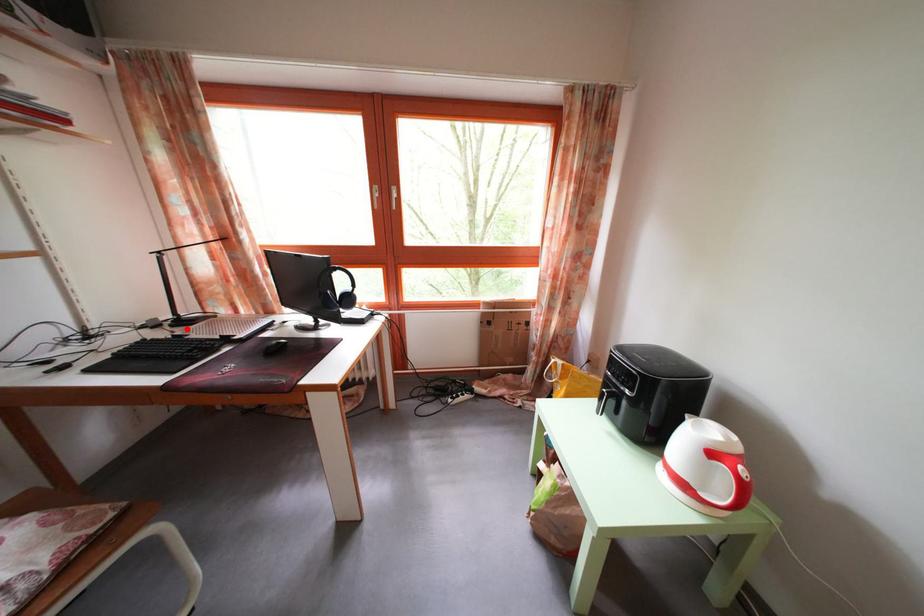
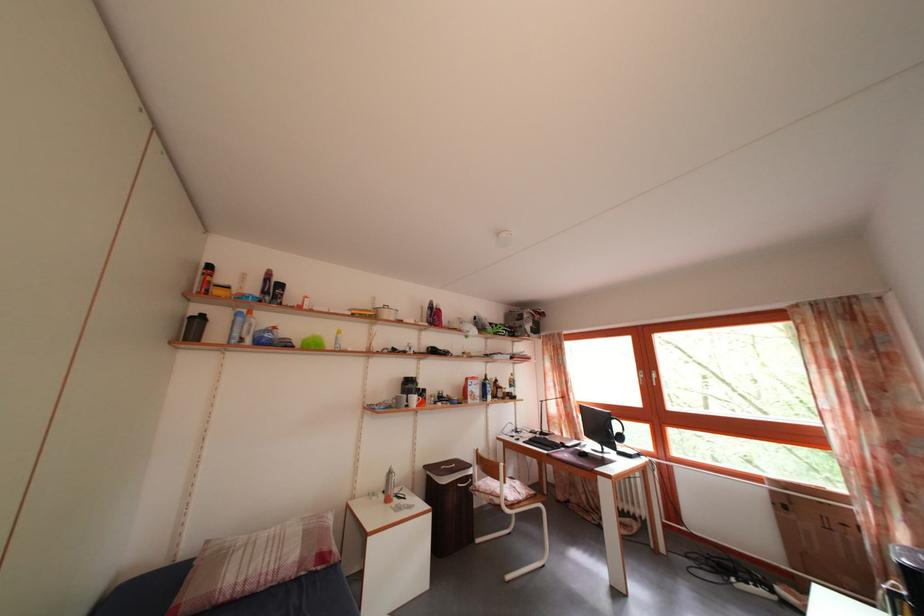
Question: A red point is marked in image1. In image2, is the corresponding 3D point closer to the camera or farther? Reply with the corresponding letter.

Choices:
 (A) The corresponding 3D point is closer.
 (B) The corresponding 3D point is farther.

Answer: (B)